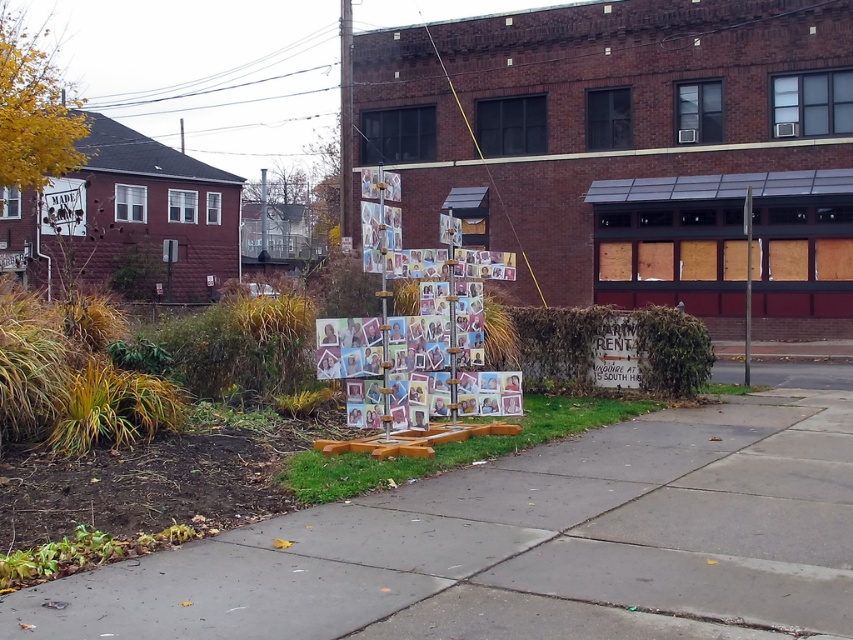
Is concrete sidewalk at center taller than wooden photo display at center?

No, concrete sidewalk at center is not taller than wooden photo display at center.

Is concrete sidewalk at center bigger than wooden photo display at center?

No.

Image resolution: width=853 pixels, height=640 pixels. Find the location of `concrete sidewalk at center`. concrete sidewalk at center is located at coordinates (526, 545).

Identify the location of concrete sidewalk at center. The width and height of the screenshot is (853, 640). (526, 545).

Between wooden photo display at center and brushed metal sign at upper left, which one is positioned higher?

Positioned higher is brushed metal sign at upper left.

Between point (346, 396) and point (64, 202), which one is positioned in front?

Point (346, 396) is in front.

The image size is (853, 640). What are the coordinates of `wooden photo display at center` in the screenshot? It's located at (419, 326).

Is concrete sidewalk at center above brushed metal sign at upper left?

Incorrect, concrete sidewalk at center is not positioned above brushed metal sign at upper left.

Who is more forward, (4,598) or (79,211)?

Point (4,598) is in front.

Who is more forward, (651, 548) or (56, 214)?

Positioned in front is point (651, 548).

You are a GUI agent. You are given a task and a screenshot of the screen. Output one action in this format:
    pyautogui.click(x=<x>, y=<y>)
    Task: Click on the concrete sidewalk at center
    The height and width of the screenshot is (640, 853).
    Given the screenshot: What is the action you would take?
    pyautogui.click(x=526, y=545)